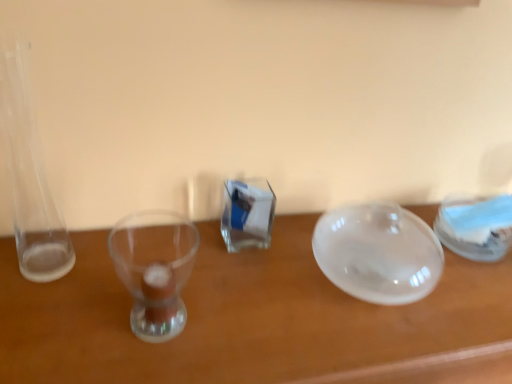
Locate an element on the screen. The image size is (512, 384). free spot above transparent glass bowl at center (from a real-world perspective) is located at coordinates (291, 285).